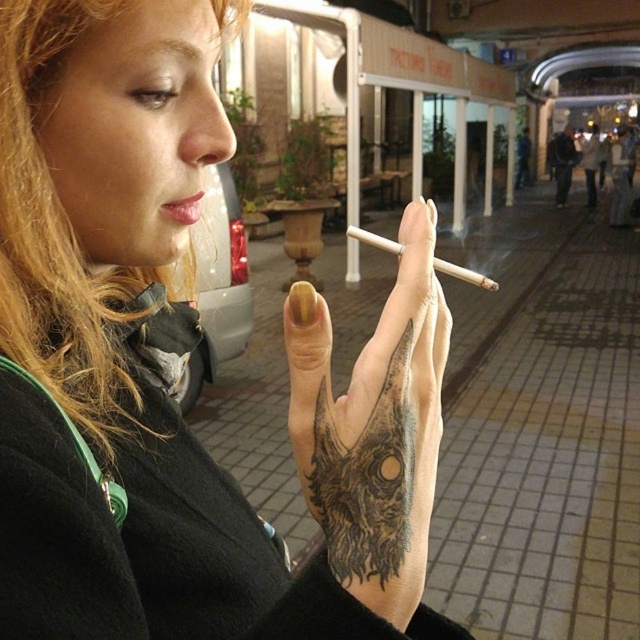
Question: Which point is farther from the camera taking this photo?

Choices:
 (A) (433, 492)
 (B) (390, 244)
 (C) (196, 196)

Answer: (C)

Question: Does black tattooed hand at center have a larger size compared to white matte cigarette at center?

Choices:
 (A) yes
 (B) no

Answer: (A)

Question: Among these points, which one is farthest from the camera?

Choices:
 (A) (403, 540)
 (B) (442, 268)
 (C) (204, 518)
 (D) (193, 209)

Answer: (D)

Question: Is black tattooed hand at center to the left of pink matte lips at center from the viewer's perspective?

Choices:
 (A) yes
 (B) no

Answer: (B)

Question: In this image, where is black matte tattoo at center located relative to black tattooed hand at center?

Choices:
 (A) left
 (B) right

Answer: (A)

Question: Which point is closer to the camera taking this photo?

Choices:
 (A) (413, 557)
 (B) (397, 470)

Answer: (B)